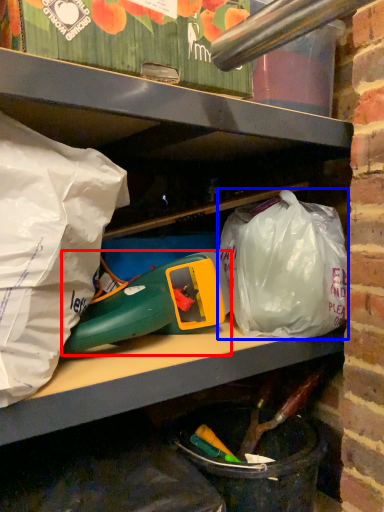
Question: Which object appears closest to the camera in this image, toy (highlighted by a red box) or plastic bag (highlighted by a blue box)?

Choices:
 (A) toy
 (B) plastic bag

Answer: (A)